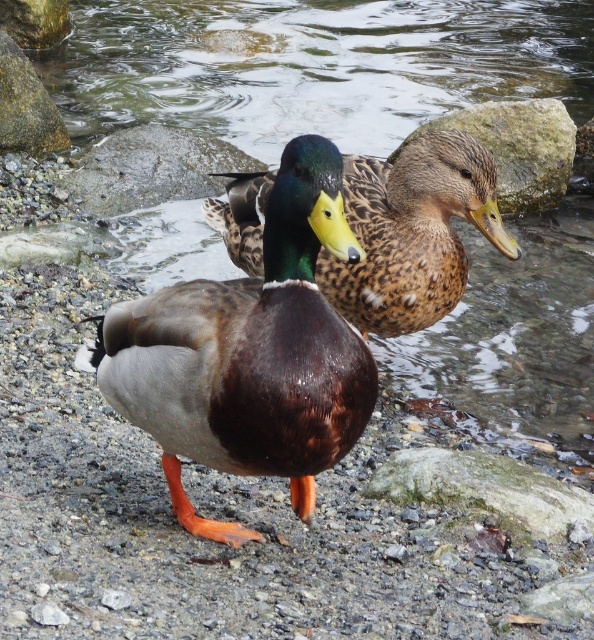
Question: Can you confirm if brown matte duck at center is bigger than brown speckled duck at center?

Choices:
 (A) yes
 (B) no

Answer: (B)

Question: Is brown speckled duck at center smaller than gray rock at center?

Choices:
 (A) yes
 (B) no

Answer: (A)

Question: Among these points, which one is farthest from the camera?

Choices:
 (A) (409, 248)
 (B) (97, 193)

Answer: (B)

Question: Among these objects, which one is nearest to the camera?

Choices:
 (A) smooth gray rock at upper left
 (B) brown rock at upper right
 (C) brown matte duck at center
 (D) brown speckled duck at center

Answer: (D)

Question: Can you confirm if brown matte duck at center is positioned to the right of smooth gray rock at upper left?

Choices:
 (A) no
 (B) yes

Answer: (B)

Question: Which object appears farthest from the camera in this image?

Choices:
 (A) smooth gray rock at upper left
 (B) shiny brown duck at center

Answer: (A)